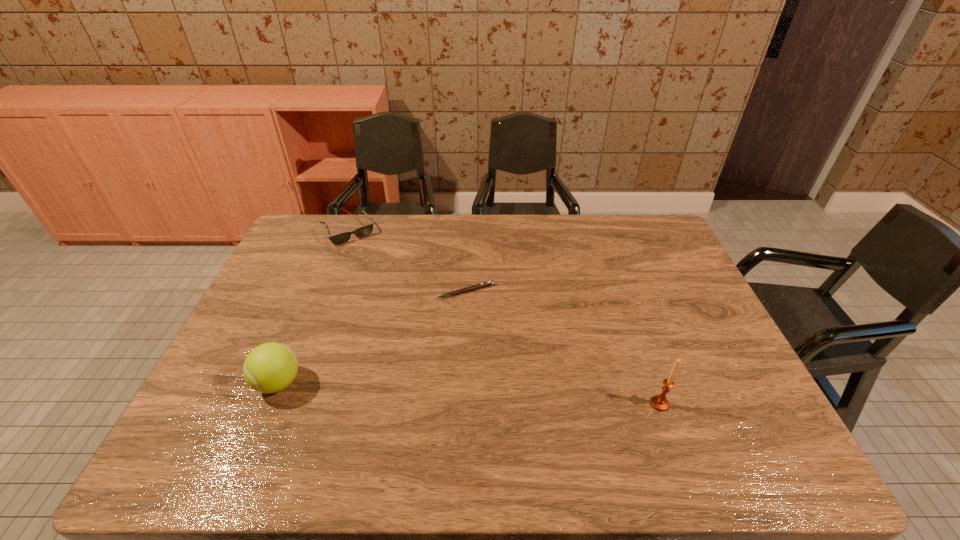
You are a GUI agent. You are given a task and a screenshot of the screen. Output one action in this format:
    pyautogui.click(x=<x>, y=<y>)
    Task: Click on the object that is at the far left corner
    This screenshot has height=540, width=960.
    Given the screenshot: What is the action you would take?
    pyautogui.click(x=363, y=231)

I want to click on object situated at the near left corner, so click(x=269, y=368).

In order to click on vacant region at the far edge of the desktop in this screenshot , I will do `click(620, 247)`.

This screenshot has width=960, height=540. In order to click on free space at the near edge of the desktop in this screenshot , I will do `click(406, 402)`.

In the image, there is a desktop. Where is `free space at the left edge`? free space at the left edge is located at coordinates tap(236, 356).

Where is `free space at the right edge of the desktop`? The height and width of the screenshot is (540, 960). free space at the right edge of the desktop is located at coordinates (672, 324).

In order to click on free space between the farthest object and the second tallest object in this screenshot , I will do point(314,307).

Locate an element on the screen. blank region between the rightmost object and the shortest object is located at coordinates (563, 347).

You are a GUI agent. You are given a task and a screenshot of the screen. Output one action in this format:
    pyautogui.click(x=<x>, y=<y>)
    Task: Click on the free space that is in between the shortest object and the candle_holder
    Image resolution: width=960 pixels, height=540 pixels.
    Given the screenshot: What is the action you would take?
    pyautogui.click(x=563, y=347)

This screenshot has width=960, height=540. Find the location of `vacant area between the second tallest object and the rightmost object`. vacant area between the second tallest object and the rightmost object is located at coordinates (469, 393).